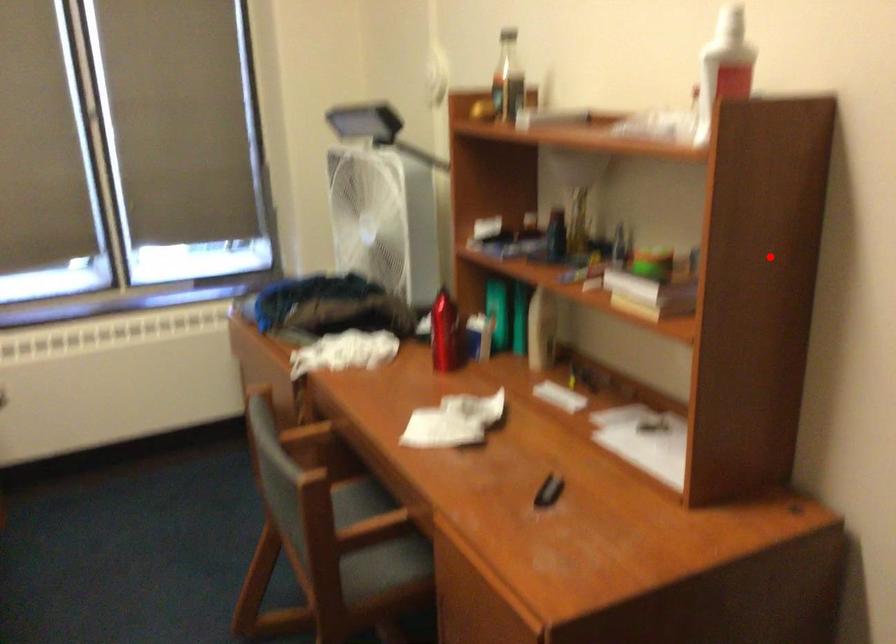
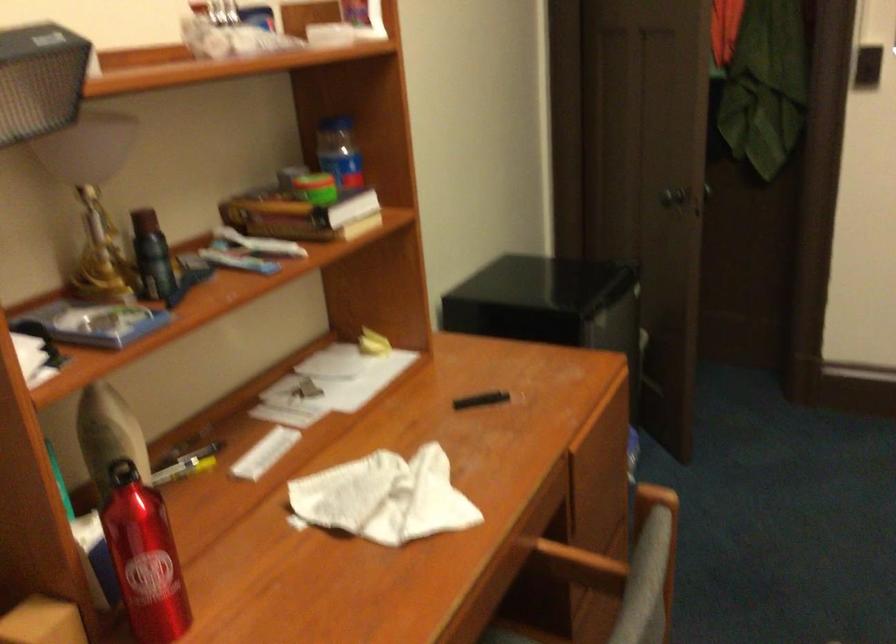
Where in the second image is the point corresponding to the highlighted location from the first image?

(339, 152)